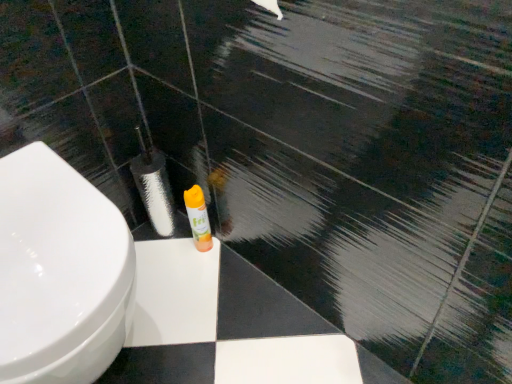
In the scene shown: In order to face orange matte spray can at center, should I rotate leftwards or rightwards?

Turn left by 7.725 degrees to look at orange matte spray can at center.

The width and height of the screenshot is (512, 384). What do you see at coordinates (198, 218) in the screenshot?
I see `orange matte spray can at center` at bounding box center [198, 218].

Where is `orange matte spray can at center`? orange matte spray can at center is located at coordinates (198, 218).

Locate an element on the screen. white glossy toilet at lower left is located at coordinates (59, 272).

The image size is (512, 384). Describe the element at coordinates (59, 272) in the screenshot. I see `white glossy toilet at lower left` at that location.

This screenshot has width=512, height=384. I want to click on orange matte spray can at center, so click(198, 218).

Considering the positions of objects orange matte spray can at center and white glossy toilet at lower left in the image provided, who is more to the left, orange matte spray can at center or white glossy toilet at lower left?

white glossy toilet at lower left is more to the left.

Considering the positions of objects orange matte spray can at center and white glossy toilet at lower left in the image provided, who is in front, orange matte spray can at center or white glossy toilet at lower left?

white glossy toilet at lower left is more forward.

Which is less distant, (x=186, y=199) or (x=57, y=230)?

Point (x=186, y=199).

From the image's perspective, is orange matte spray can at center located above white glossy toilet at lower left?

Yes, from the image's perspective, orange matte spray can at center is on top of white glossy toilet at lower left.

From a real-world perspective, which object stands above the other?

white glossy toilet at lower left, from a real-world perspective.

Considering the sizes of objects orange matte spray can at center and white glossy toilet at lower left in the image provided, who is wider, orange matte spray can at center or white glossy toilet at lower left?

white glossy toilet at lower left.

Is orange matte spray can at center taller than white glossy toilet at lower left?

No.

Which of these two, orange matte spray can at center or white glossy toilet at lower left, is bigger?

With larger size is white glossy toilet at lower left.

Is white glossy toilet at lower left surrounded by orange matte spray can at center?

Actually, white glossy toilet at lower left is outside orange matte spray can at center.

Is orange matte spray can at center beside white glossy toilet at lower left?

No, orange matte spray can at center is not in contact with white glossy toilet at lower left.

Is orange matte spray can at center facing towards white glossy toilet at lower left?

No, orange matte spray can at center is not aimed at white glossy toilet at lower left.

How many degrees apart are the facing directions of orange matte spray can at center and white glossy toilet at lower left?

There is a 0.000957-degree angle between the facing directions of orange matte spray can at center and white glossy toilet at lower left.

At what (x,y) coordinates should I click in order to perform the action: click on toilet above the orange matte spray can at center (from a real-world perspective). Please return your answer as a coordinate pair (x, y). The height and width of the screenshot is (384, 512). Looking at the image, I should click on (59, 272).

Considering the relative positions of white glossy toilet at lower left and orange matte spray can at center in the image provided, is white glossy toilet at lower left to the left of orange matte spray can at center from the viewer's perspective?

Yes, white glossy toilet at lower left is to the left of orange matte spray can at center.

Is white glossy toilet at lower left behind orange matte spray can at center?

No.

Is point (4, 281) closer or farther from the camera than point (198, 236)?

Point (4, 281) appears to be closer to the viewer than point (198, 236).

From the image's perspective, which one is positioned lower, white glossy toilet at lower left or orange matte spray can at center?

white glossy toilet at lower left appears lower in the image.

From a real-world perspective, who is located lower, white glossy toilet at lower left or orange matte spray can at center?

orange matte spray can at center.

Which object is wider, white glossy toilet at lower left or orange matte spray can at center?

white glossy toilet at lower left is wider.

Can you confirm if white glossy toilet at lower left is taller than orange matte spray can at center?

Yes, white glossy toilet at lower left is taller than orange matte spray can at center.

Is white glossy toilet at lower left smaller than orange matte spray can at center?

Incorrect, white glossy toilet at lower left is not smaller in size than orange matte spray can at center.

Is white glossy toilet at lower left outside of orange matte spray can at center?

That's correct, white glossy toilet at lower left is outside of orange matte spray can at center.

Does white glossy toilet at lower left touch orange matte spray can at center?

There is a gap between white glossy toilet at lower left and orange matte spray can at center.

Is white glossy toilet at lower left positioned with its back to orange matte spray can at center?

white glossy toilet at lower left is not turned away from orange matte spray can at center.

What's the angular difference between white glossy toilet at lower left and orange matte spray can at center's facing directions?

The angle between the facing direction of white glossy toilet at lower left and the facing direction of orange matte spray can at center is 0.000957 degrees.

The height and width of the screenshot is (384, 512). In order to click on toiletry below the white glossy toilet at lower left (from a real-world perspective) in this screenshot , I will do `click(198, 218)`.

Where is `toilet below the orange matte spray can at center (from the image's perspective)`? The image size is (512, 384). toilet below the orange matte spray can at center (from the image's perspective) is located at coordinates (59, 272).

Where is `toilet that appears on the left of orange matte spray can at center`? toilet that appears on the left of orange matte spray can at center is located at coordinates (59, 272).